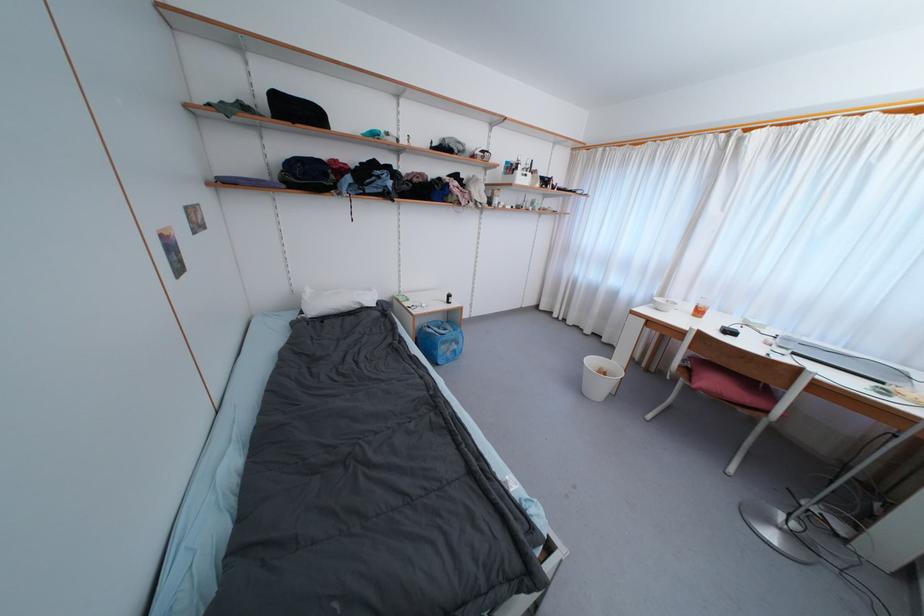
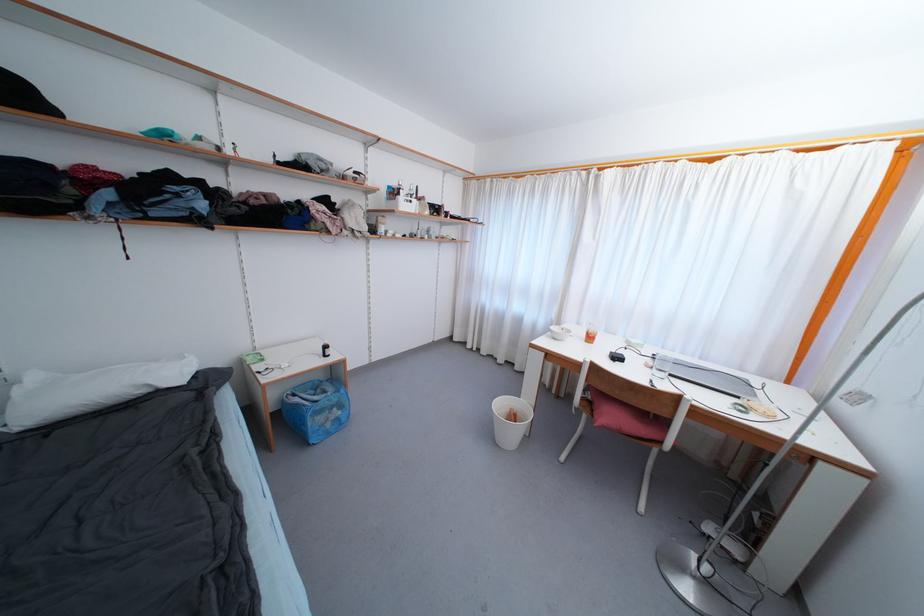
Where in the second image is the point corresponding to the point at 596,363 from the first image?

(505, 407)